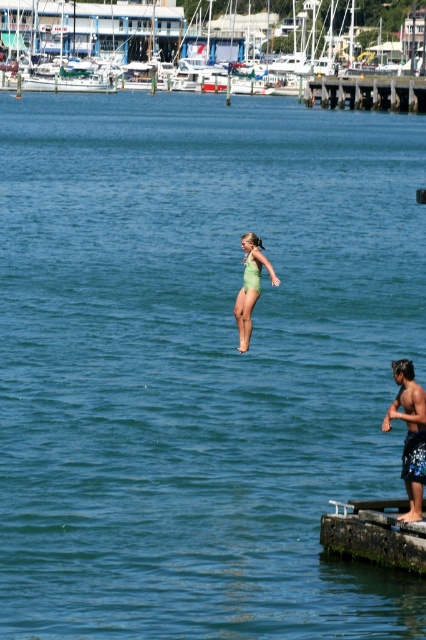
Question: Can you confirm if green mossy wood dock at lower right is smaller than blue patterned shorts at right?

Choices:
 (A) yes
 (B) no

Answer: (B)

Question: Which object is the farthest from the white glossy boat at upper center?

Choices:
 (A) green fabric swimsuit at center
 (B) dark gray concrete dock at upper center
 (C) green mossy wood dock at lower right

Answer: (A)

Question: Is dark gray concrete dock at upper center thinner than blue patterned shorts at right?

Choices:
 (A) yes
 (B) no

Answer: (B)

Question: Considering the real-world distances, which object is farthest from the green mossy wood dock at lower right?

Choices:
 (A) blue patterned shorts at right
 (B) green fabric swimsuit at center
 (C) dark gray concrete dock at upper center
 (D) white glossy boat at upper center

Answer: (D)

Question: Which point is farther from the camera taking this photo?

Choices:
 (A) (409, 372)
 (B) (120, 32)
 (C) (385, 93)
 (D) (241, 321)

Answer: (B)

Question: Can you confirm if green mossy wood dock at lower right is positioned to the right of dark gray concrete dock at upper center?

Choices:
 (A) no
 (B) yes

Answer: (A)